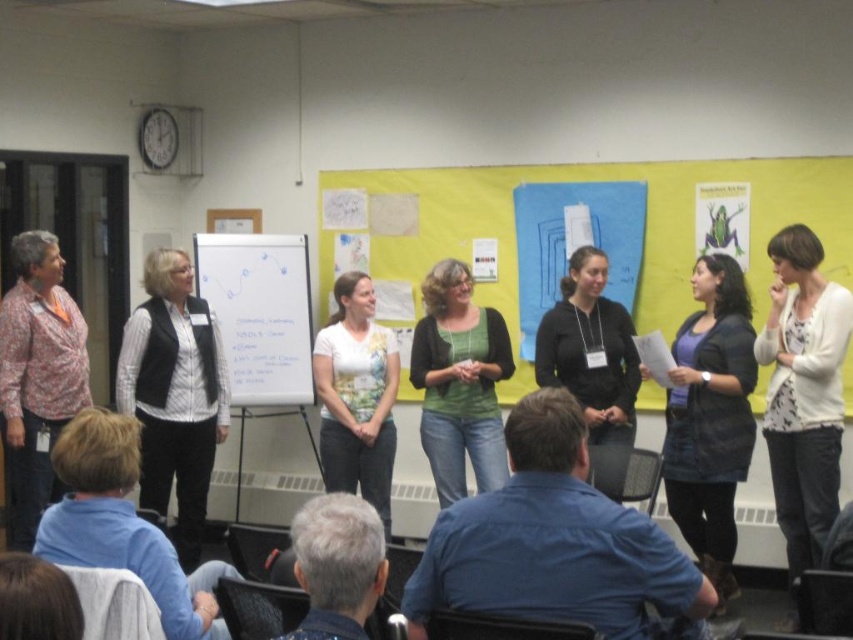
Question: Is black matte vest at center positioned in front of white matte shirt at center?

Choices:
 (A) yes
 (B) no

Answer: (A)

Question: Which point appears closest to the camera in this image?

Choices:
 (A) [x=730, y=536]
 (B) [x=44, y=269]

Answer: (A)

Question: Among these points, which one is farthest from the camera?

Choices:
 (A) (456, 296)
 (B) (747, 371)
 (C) (769, 356)
 (D) (33, 241)

Answer: (A)

Question: Which point appears farthest from the camera in this image?

Choices:
 (A) (344, 369)
 (B) (590, 476)
 (C) (39, 324)
 (D) (225, 296)

Answer: (D)

Question: Does denim skirt at center have a lesser width compared to black matte vest at center?

Choices:
 (A) no
 (B) yes

Answer: (A)

Question: Is white textured cardigan at center thinner than whiteboard at center?

Choices:
 (A) yes
 (B) no

Answer: (A)